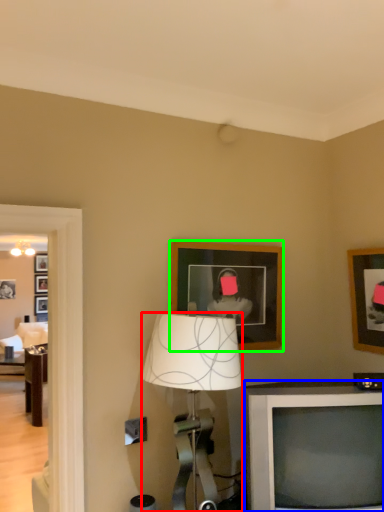
Question: Which is nearer to the lamp (highlighted by a red box)? television (highlighted by a blue box) or picture frame (highlighted by a green box).

Choices:
 (A) television
 (B) picture frame

Answer: (A)